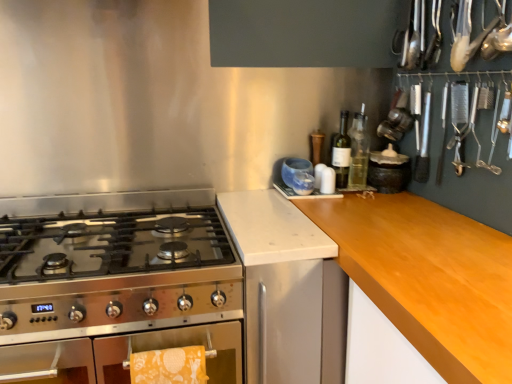
Question: Can you confirm if matte black jar at upper right is positioned to the left of yellow printed towel at lower left?

Choices:
 (A) yes
 (B) no

Answer: (B)

Question: From a real-world perspective, is matte black jar at upper right physically above yellow printed towel at lower left?

Choices:
 (A) yes
 (B) no

Answer: (A)

Question: From the image's perspective, is matte black jar at upper right below yellow printed towel at lower left?

Choices:
 (A) yes
 (B) no

Answer: (B)

Question: Could you tell me if matte black jar at upper right is facing yellow printed towel at lower left?

Choices:
 (A) no
 (B) yes

Answer: (A)

Question: Are matte black jar at upper right and yellow printed towel at lower left located far from each other?

Choices:
 (A) yes
 (B) no

Answer: (B)

Question: Can you see matte black jar at upper right touching yellow printed towel at lower left?

Choices:
 (A) yes
 (B) no

Answer: (B)

Question: From a real-world perspective, does yellow printed towel at lower left stand above clear glass bottle at upper right, marked as the first bottle in a right-to-left arrangement?

Choices:
 (A) no
 (B) yes

Answer: (A)

Question: Is there a large distance between yellow printed towel at lower left and clear glass bottle at upper right, the 2th bottle in the left-to-right sequence?

Choices:
 (A) yes
 (B) no

Answer: (B)

Question: From the image's perspective, would you say yellow printed towel at lower left is positioned over clear glass bottle at upper right, the 2th bottle in the left-to-right sequence?

Choices:
 (A) no
 (B) yes

Answer: (A)

Question: Would you say yellow printed towel at lower left contains clear glass bottle at upper right, marked as the first bottle in a right-to-left arrangement?

Choices:
 (A) no
 (B) yes

Answer: (A)

Question: From a real-world perspective, is yellow printed towel at lower left beneath clear glass bottle at upper right, the 2th bottle in the left-to-right sequence?

Choices:
 (A) yes
 (B) no

Answer: (A)

Question: Is yellow printed towel at lower left bigger than clear glass bottle at upper right, marked as the first bottle in a right-to-left arrangement?

Choices:
 (A) yes
 (B) no

Answer: (A)

Question: Does matte black jar at upper right have a lesser width compared to clear glass bottle at upper right, the 2th bottle in the left-to-right sequence?

Choices:
 (A) no
 (B) yes

Answer: (A)